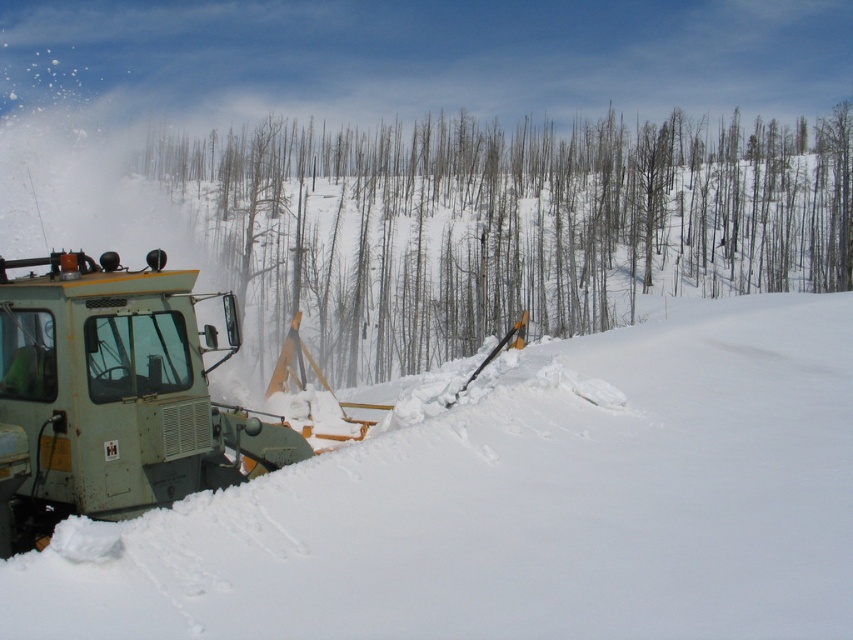
You are a snowplow operator who needs to clear a path through the snow. You see the white powdery snow at lower left and the gray bark trees at center. Which area requires more effort to clear because it has more snow?

The gray bark trees at center require more effort to clear because the white powdery snow at lower left is thinner than them, indicating less snow accumulation there.

You are a snowplow operator trying to clear a path. You notice the white powdery snow at lower left and the gray bark trees at center. Which object is nearer to you as you sit in the snowplow operator seat?

The white powdery snow at lower left is closer to the viewer than the gray bark trees at center, so the white powdery snow at lower left is nearer to you as you sit in the snowplow operator seat.

In the scene shown: You are a delivery robot with a width of 1.2 meters. You need to navigate through the snowy path created by the green matte snowplow at lower left. There is white powdery snow at lower left blocking your path. Can you pass through the gap between the snowplow and the snow pile?

The white powdery snow at lower left is 4.18 meters away from the green matte snowplow at lower left. Since the gap between them is wider than the robot width of 1.2 meters, the delivery robot can safely pass through the gap between the green matte snowplow at lower left and the white powdery snow at lower left.